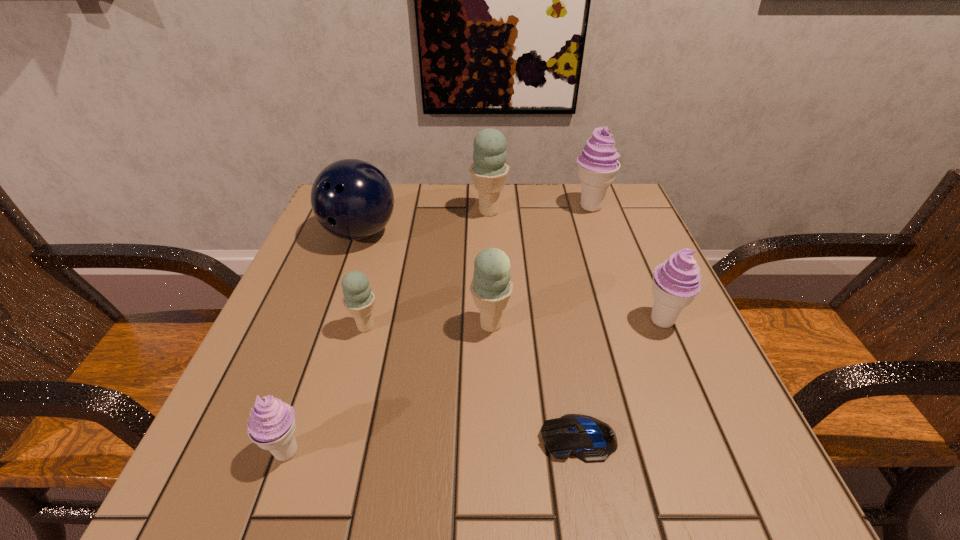
Choose which purple icecream is the third nearest neighbor to the second icecream from left to right. Please provide its 2D coordinates. Your answer should be formatted as a tuple, i.e. [(x, y)], where the tuple contains the x and y coordinates of a point satisfying the conditions above.

[(598, 165)]

What are the coordinates of `vacant point that satisfies the following two spatial constraints: 1. on the back side of the second smallest blue ice cream; 2. on the left side of the farthest purple icecream` in the screenshot? It's located at (488, 207).

Locate an element on the screen. blank space that satisfies the following two spatial constraints: 1. on the front side of the second biggest purple icecream; 2. on the right side of the farthest blue ice cream is located at coordinates (492, 321).

The height and width of the screenshot is (540, 960). Identify the location of free space in the image that satisfies the following two spatial constraints: 1. on the surface of the second farthest purple icecream near the finger holes; 2. on the left side of the blue bowling ball. (329, 321).

This screenshot has width=960, height=540. What are the coordinates of `vacant position in the image that satisfies the following two spatial constraints: 1. on the surface of the bowling ball near the finger holes; 2. on the left side of the second smallest blue ice cream` in the screenshot? It's located at (328, 325).